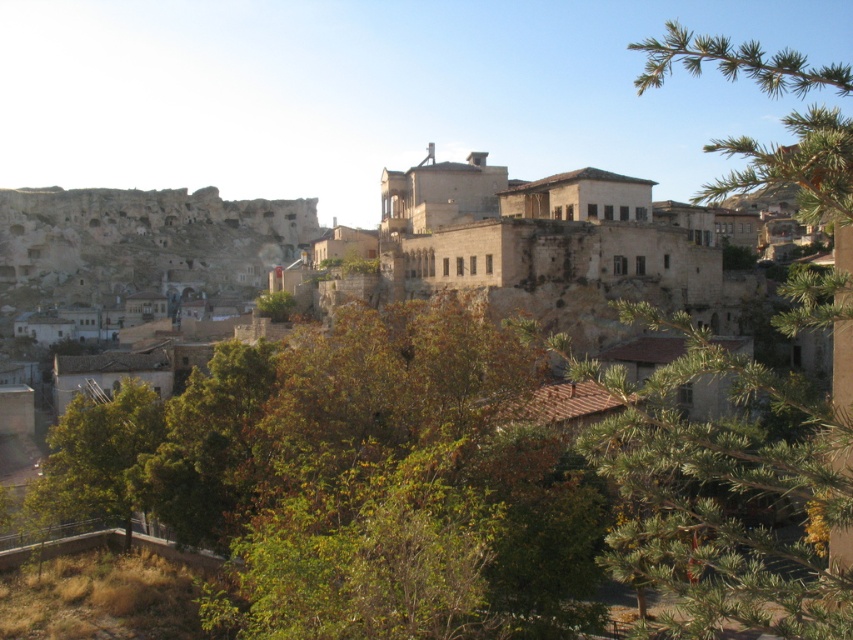
Question: Does brown stone village at center appear under green leafy tree at lower left?

Choices:
 (A) no
 (B) yes

Answer: (A)

Question: Is brown stone village at center above green leafy tree at lower left?

Choices:
 (A) no
 (B) yes

Answer: (B)

Question: Does green needle-like leaves at upper right have a larger size compared to green leafy tree at lower left?

Choices:
 (A) no
 (B) yes

Answer: (B)

Question: Among these objects, which one is nearest to the camera?

Choices:
 (A) green needle-like leaves at upper right
 (B) green leafy tree at lower left
 (C) brown stone village at center

Answer: (A)

Question: Estimate the real-world distances between objects in this image. Which object is farther from the green needle-like leaves at upper right?

Choices:
 (A) green leafy tree at lower left
 (B) brown stone village at center

Answer: (B)

Question: Which is nearer to the green needle-like leaves at upper right?

Choices:
 (A) brown stone village at center
 (B) green leafy tree at lower left

Answer: (B)